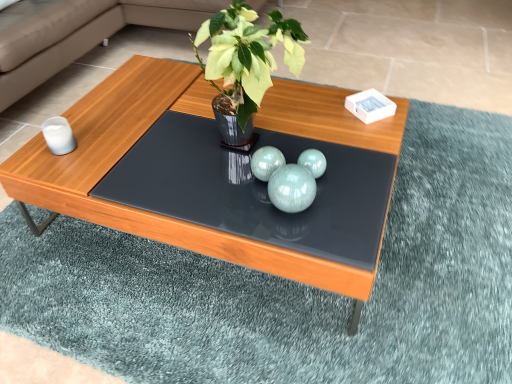
The image size is (512, 384). Identify the location of green glossy vase at center. (246, 59).

Locate an element on the screen. The image size is (512, 384). shiny black glass table at center is located at coordinates (255, 189).

You are a GUI agent. You are given a task and a screenshot of the screen. Output one action in this format:
    pyautogui.click(x=<x>, y=<y>)
    Task: Click on the coffee table located on the left of shiny black glass table at center
    
    Given the screenshot: What is the action you would take?
    pyautogui.click(x=201, y=116)

Is matte wooden coffee table at center oriented away from shiny black glass table at center?

No, matte wooden coffee table at center is not facing the opposite direction of shiny black glass table at center.

Is point (216, 240) farther from camera compared to point (176, 210)?

No, it is in front of (176, 210).

Based on the photo, is matte wooden coffee table at center beside shiny black glass table at center?

No, matte wooden coffee table at center is not in contact with shiny black glass table at center.

Can you confirm if shiny black glass table at center is smaller than green glossy vase at center?

Yes.

Is shiny black glass table at center in contact with green glossy vase at center?

No, shiny black glass table at center is not in contact with green glossy vase at center.

Which is farther from the camera, (x=205, y=168) or (x=231, y=138)?

The point (x=231, y=138) is farther.

Considering the relative positions of teal glossy spheres at center and shiny black glass table at center in the image provided, is teal glossy spheres at center to the left or to the right of shiny black glass table at center?

Clearly, teal glossy spheres at center is on the right of shiny black glass table at center in the image.

Where is `glass table in front of the teal glossy spheres at center`? glass table in front of the teal glossy spheres at center is located at coordinates tap(255, 189).

From the image's perspective, relative to shiny black glass table at center, is teal glossy spheres at center above or below?

Clearly, from the image's perspective, teal glossy spheres at center is below shiny black glass table at center.

From a real-world perspective, is teal glossy spheres at center physically located above or below shiny black glass table at center?

teal glossy spheres at center is situated higher than shiny black glass table at center in the real world.

From the image's perspective, is green glossy vase at center located above or below teal glossy spheres at center?

green glossy vase at center is above teal glossy spheres at center.

Which of these two, green glossy vase at center or teal glossy spheres at center, stands taller?

Standing taller between the two is green glossy vase at center.

Is green glossy vase at center oriented towards teal glossy spheres at center?

No.

Which of these two, green glossy vase at center or shiny black glass table at center, is smaller?

Smaller between the two is shiny black glass table at center.

From a real-world perspective, between green glossy vase at center and shiny black glass table at center, who is vertically lower?

In real-world perspective, shiny black glass table at center is lower.

Which is behind, point (228, 105) or point (132, 166)?

The point (132, 166) is farther from the camera.

From the image's perspective, is green glossy vase at center over shiny black glass table at center?

Yes, from the image's perspective, green glossy vase at center is above shiny black glass table at center.

Can you see matte wooden coffee table at center touching green glossy vase at center?

matte wooden coffee table at center and green glossy vase at center are clearly separated.

From a real-world perspective, which object stands above the other?

In real-world perspective, green glossy vase at center is above.

Is matte wooden coffee table at center located outside green glossy vase at center?

Absolutely, matte wooden coffee table at center is external to green glossy vase at center.

Is point (110, 126) positioned behind point (280, 41)?

Yes, point (110, 126) is farther from viewer.

From a real-world perspective, who is located lower, shiny black glass table at center or matte wooden coffee table at center?

matte wooden coffee table at center.

Considering the positions of objects shiny black glass table at center and matte wooden coffee table at center in the image provided, who is more to the left, shiny black glass table at center or matte wooden coffee table at center?

matte wooden coffee table at center.

Considering the relative sizes of shiny black glass table at center and matte wooden coffee table at center in the image provided, is shiny black glass table at center taller than matte wooden coffee table at center?

Incorrect, the height of shiny black glass table at center is not larger of that of matte wooden coffee table at center.

Who is bigger, shiny black glass table at center or matte wooden coffee table at center?

matte wooden coffee table at center is bigger.

Identify the location of coffee table directly beneath the shiny black glass table at center (from a real-world perspective). This screenshot has width=512, height=384. (201, 116).

I want to click on houseplant that is above the shiny black glass table at center (from the image's perspective), so (246, 59).

Which object lies nearer to the anchor point shiny black glass table at center, teal glossy spheres at center or green glossy vase at center?

teal glossy spheres at center is closer to shiny black glass table at center.

Which object lies nearer to the anchor point teal glossy spheres at center, green glossy vase at center or shiny black glass table at center?

shiny black glass table at center.

Considering their positions, is teal glossy spheres at center positioned closer to green glossy vase at center than matte wooden coffee table at center?

teal glossy spheres at center lies closer to green glossy vase at center than the other object.

Looking at the image, which one is located closer to teal glossy spheres at center, matte wooden coffee table at center or shiny black glass table at center?

shiny black glass table at center is closer to teal glossy spheres at center.

Based on their spatial positions, is shiny black glass table at center or green glossy vase at center closer to teal glossy spheres at center?

shiny black glass table at center is closer to teal glossy spheres at center.

Looking at the image, which one is located further to matte wooden coffee table at center, green glossy vase at center or shiny black glass table at center?

green glossy vase at center is further to matte wooden coffee table at center.

Considering their positions, is shiny black glass table at center positioned closer to teal glossy spheres at center than matte wooden coffee table at center?

shiny black glass table at center lies closer to teal glossy spheres at center than the other object.

Considering their positions, is matte wooden coffee table at center positioned further to green glossy vase at center than teal glossy spheres at center?

Among the two, matte wooden coffee table at center is located further to green glossy vase at center.

At what (x,y) coordinates should I click in order to perform the action: click on coffee table between green glossy vase at center and teal glossy spheres at center from top to bottom. Please return your answer as a coordinate pair (x, y). This screenshot has height=384, width=512. Looking at the image, I should click on (201, 116).

The width and height of the screenshot is (512, 384). I want to click on glass table between green glossy vase at center and teal glossy spheres at center in the vertical direction, so click(x=255, y=189).

The width and height of the screenshot is (512, 384). Identify the location of coffee table between green glossy vase at center and shiny black glass table at center from top to bottom. point(201,116).

Image resolution: width=512 pixels, height=384 pixels. Identify the location of glass table situated between matte wooden coffee table at center and teal glossy spheres at center from left to right. (255, 189).